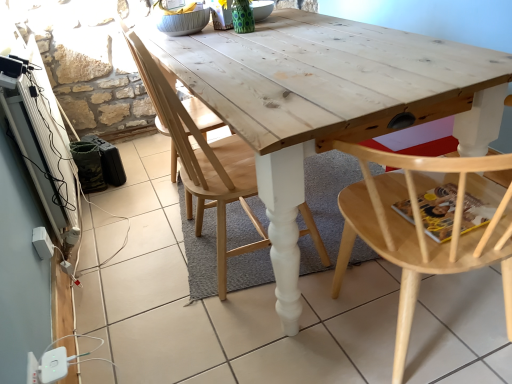
Question: Which direction should I rotate to face natural wood chair at center, which ranks as the third chair in left-to-right order, — up or down?

Choices:
 (A) down
 (B) up

Answer: (A)

Question: Considering the relative sizes of natural wood chair at center, which appears as the 2th chair when viewed from the left, and natural wood chair at center, placed as the first chair when sorted from left to right, in the image provided, is natural wood chair at center, which appears as the 2th chair when viewed from the left, wider than natural wood chair at center, placed as the first chair when sorted from left to right,?

Choices:
 (A) yes
 (B) no

Answer: (B)

Question: Considering the relative positions of natural wood chair at center, which appears as the 2th chair when viewed from the left, and natural wood chair at center, placed as the first chair when sorted from left to right, in the image provided, is natural wood chair at center, which appears as the 2th chair when viewed from the left, to the left of natural wood chair at center, placed as the first chair when sorted from left to right, from the viewer's perspective?

Choices:
 (A) no
 (B) yes

Answer: (A)

Question: Is natural wood chair at center, which appears as the 2th chair when viewed from the left, closer to camera compared to natural wood chair at center, positioned as the 3th chair in right-to-left order?

Choices:
 (A) yes
 (B) no

Answer: (A)

Question: Would you say natural wood chair at center, which appears as the 2th chair when viewed from the left, contains natural wood chair at center, placed as the first chair when sorted from left to right?

Choices:
 (A) no
 (B) yes

Answer: (A)

Question: Considering the relative sizes of natural wood chair at center, which appears as the 2th chair when viewed from the left, and natural wood chair at center, positioned as the 3th chair in right-to-left order, in the image provided, is natural wood chair at center, which appears as the 2th chair when viewed from the left, shorter than natural wood chair at center, positioned as the 3th chair in right-to-left order,?

Choices:
 (A) no
 (B) yes

Answer: (B)

Question: Does natural wood chair at center, which is the second chair in right-to-left order, have a smaller size compared to natural wood chair at center, positioned as the 3th chair in right-to-left order?

Choices:
 (A) no
 (B) yes

Answer: (B)

Question: Is natural wood chair at center, positioned as the 3th chair in right-to-left order, smaller than natural wood table at center?

Choices:
 (A) yes
 (B) no

Answer: (B)

Question: Considering the relative sizes of natural wood chair at center, placed as the first chair when sorted from left to right, and natural wood table at center in the image provided, is natural wood chair at center, placed as the first chair when sorted from left to right, thinner than natural wood table at center?

Choices:
 (A) no
 (B) yes

Answer: (B)

Question: Does natural wood chair at center, positioned as the 3th chair in right-to-left order, touch natural wood table at center?

Choices:
 (A) no
 (B) yes

Answer: (A)

Question: Does natural wood chair at center, positioned as the 3th chair in right-to-left order, lie in front of natural wood table at center?

Choices:
 (A) no
 (B) yes

Answer: (A)

Question: From the image's perspective, would you say natural wood chair at center, positioned as the 3th chair in right-to-left order, is positioned over natural wood table at center?

Choices:
 (A) no
 (B) yes

Answer: (B)

Question: Considering the relative sizes of natural wood chair at center, positioned as the 3th chair in right-to-left order, and natural wood table at center in the image provided, is natural wood chair at center, positioned as the 3th chair in right-to-left order, shorter than natural wood table at center?

Choices:
 (A) no
 (B) yes

Answer: (A)

Question: Is natural wood table at center at the right side of natural wood chair at center, placed as the first chair when sorted from left to right?

Choices:
 (A) no
 (B) yes

Answer: (B)